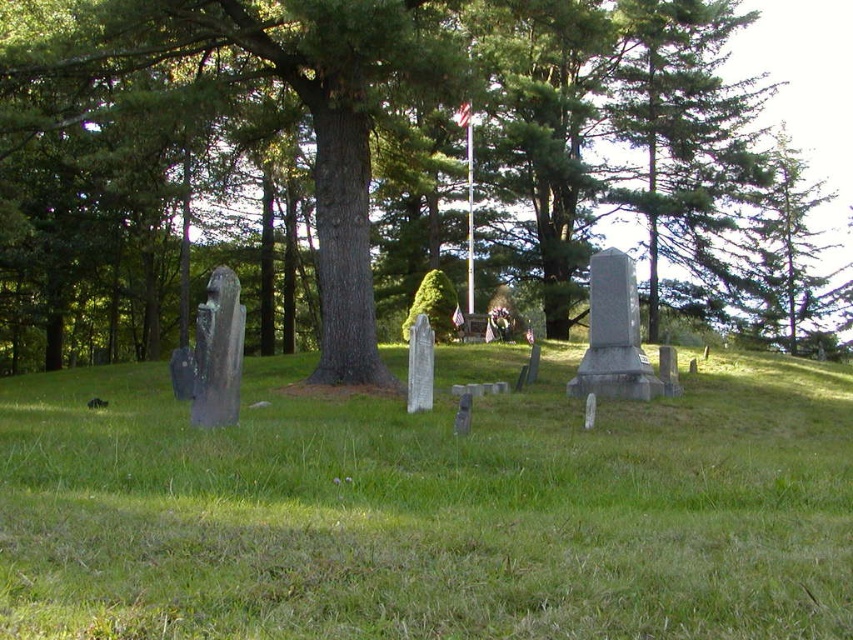
Question: Which of the following is the farthest from the observer?

Choices:
 (A) (480, 26)
 (B) (698, 499)

Answer: (A)

Question: Is green grassy at center thinner than green textured tree at center?

Choices:
 (A) no
 (B) yes

Answer: (B)

Question: Does green grassy at center appear on the right side of green textured tree at center?

Choices:
 (A) yes
 (B) no

Answer: (B)

Question: Considering the relative positions of green grassy at center and green textured tree at center in the image provided, where is green grassy at center located with respect to green textured tree at center?

Choices:
 (A) right
 (B) left

Answer: (B)

Question: Among these points, which one is farthest from the camera?

Choices:
 (A) (335, 602)
 (B) (96, 152)

Answer: (B)

Question: Among these objects, which one is farthest from the camera?

Choices:
 (A) green textured tree at center
 (B) green grassy at center

Answer: (A)